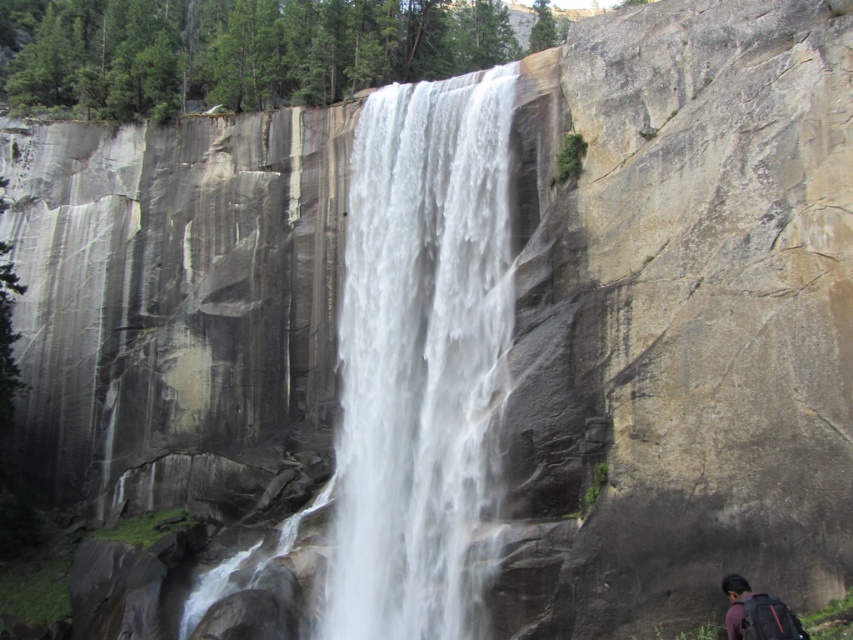
Question: Which object is farther from the camera taking this photo?

Choices:
 (A) dark gray backpack at lower right
 (B) white smooth waterfall at center

Answer: (B)

Question: Is white smooth waterfall at center closer to camera compared to dark gray backpack at lower right?

Choices:
 (A) no
 (B) yes

Answer: (A)

Question: Does white smooth waterfall at center appear on the right side of dark gray backpack at lower right?

Choices:
 (A) no
 (B) yes

Answer: (A)

Question: Is white smooth waterfall at center bigger than dark gray backpack at lower right?

Choices:
 (A) yes
 (B) no

Answer: (A)